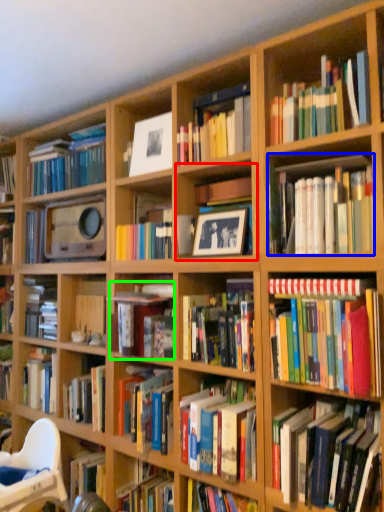
Question: Which object is positioned closest to cabinet (highlighted by a red box)? Select from book (highlighted by a blue box) and book (highlighted by a green box).

Choices:
 (A) book
 (B) book

Answer: (A)